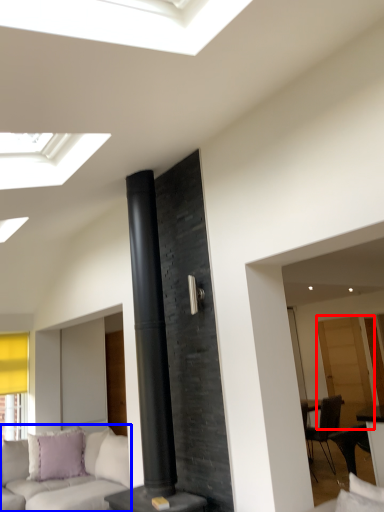
Question: Which point is closer to the camera, glass door (highlighted by a red box) or studio couch (highlighted by a blue box)?

Choices:
 (A) glass door
 (B) studio couch

Answer: (B)